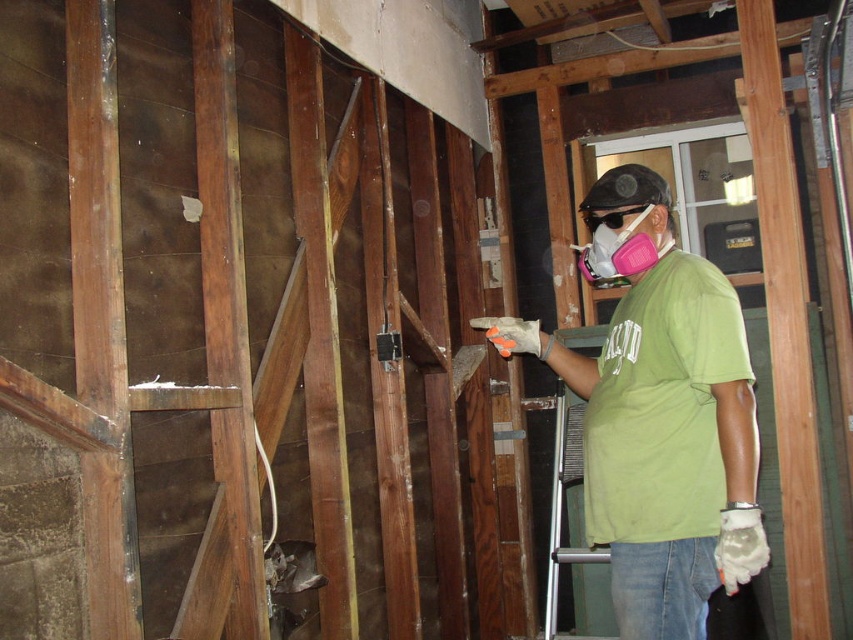
Question: Is green matte shirt at center thinner than pink foam respirator at center?

Choices:
 (A) yes
 (B) no

Answer: (B)

Question: Is green matte shirt at center bigger than pink foam respirator at center?

Choices:
 (A) no
 (B) yes

Answer: (B)

Question: Which point is closer to the camera?

Choices:
 (A) [x=651, y=266]
 (B) [x=618, y=472]

Answer: (B)

Question: Which of the following is the closest to the observer?

Choices:
 (A) (596, 257)
 (B) (729, 580)

Answer: (B)

Question: Can you confirm if green matte shirt at center is wider than pink foam respirator at center?

Choices:
 (A) no
 (B) yes

Answer: (B)